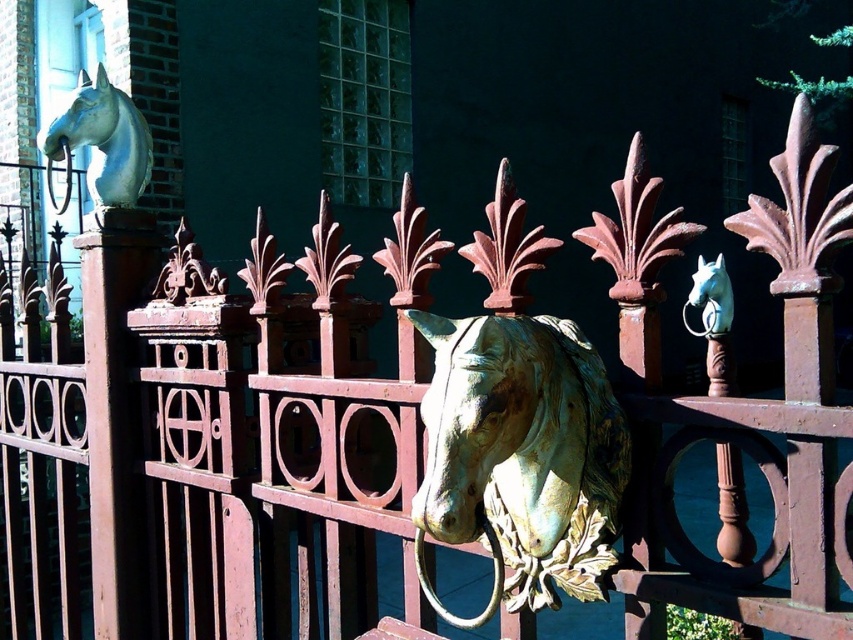
Which of these two, gold patina metal horse head at center or shiny white horse head at upper left, stands shorter?

shiny white horse head at upper left

Can you confirm if gold patina metal horse head at center is taller than shiny white horse head at upper left?

Yes.

What do you see at coordinates (519, 433) in the screenshot? This screenshot has width=853, height=640. I see `gold patina metal horse head at center` at bounding box center [519, 433].

Find the location of a particular element. Image resolution: width=853 pixels, height=640 pixels. gold patina metal horse head at center is located at coordinates (519, 433).

Is matte green horse head at upper left shorter than shiny white horse head at upper left?

Incorrect, matte green horse head at upper left's height does not fall short of shiny white horse head at upper left's.

Is point (105, 193) closer to viewer compared to point (729, 300)?

That is False.

Image resolution: width=853 pixels, height=640 pixels. Find the location of `matte green horse head at upper left`. matte green horse head at upper left is located at coordinates (102, 141).

Who is more forward, (486, 212) or (96, 144)?

Point (486, 212)

Does gold patina metal horse head at center appear under matte green horse head at upper left?

Indeed, gold patina metal horse head at center is positioned under matte green horse head at upper left.

At what (x,y) coordinates should I click in order to perform the action: click on gold patina metal horse head at center. Please return your answer as a coordinate pair (x, y). Looking at the image, I should click on (519, 433).

Image resolution: width=853 pixels, height=640 pixels. What are the coordinates of `gold patina metal horse head at center` in the screenshot? It's located at (519, 433).